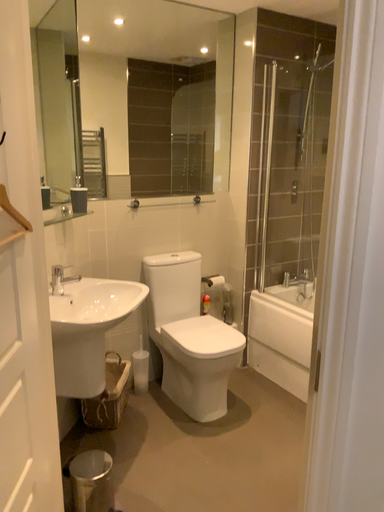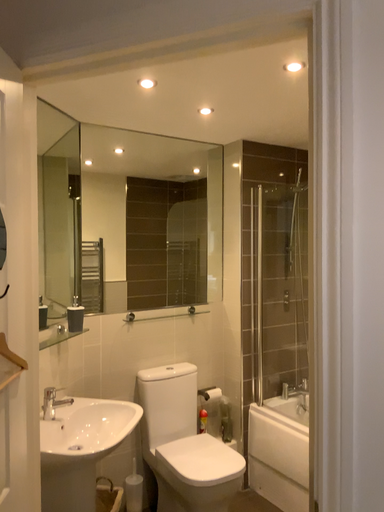
Question: How did the camera likely rotate when shooting the video?

Choices:
 (A) rotated upward
 (B) rotated downward

Answer: (A)